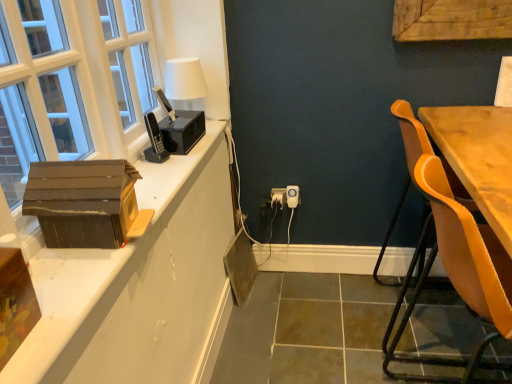
Question: Could you tell me if brown cardboard box at left, which is counted as the first cardboard box, starting from the top, is turned towards white plastic electric outlet at center?

Choices:
 (A) yes
 (B) no

Answer: (B)

Question: From a real-world perspective, is brown cardboard box at left, the second cardboard box in the front-to-back sequence, physically below white plastic electric outlet at center?

Choices:
 (A) no
 (B) yes

Answer: (A)

Question: Does brown cardboard box at left, the second cardboard box when ordered from bottom to top, have a lesser width compared to white plastic electric outlet at center?

Choices:
 (A) yes
 (B) no

Answer: (B)

Question: From the image's perspective, does brown cardboard box at left, the second cardboard box in the front-to-back sequence, appear lower than white plastic electric outlet at center?

Choices:
 (A) yes
 (B) no

Answer: (B)

Question: Can you see brown cardboard box at left, which is counted as the first cardboard box, starting from the top, touching white plastic electric outlet at center?

Choices:
 (A) no
 (B) yes

Answer: (A)

Question: Does brown cardboard box at left, which is counted as the first cardboard box, starting from the top, contain white plastic electric outlet at center?

Choices:
 (A) no
 (B) yes

Answer: (A)

Question: Can you confirm if leatherette chair at right is thinner than white matte table lamp at upper left?

Choices:
 (A) no
 (B) yes

Answer: (A)

Question: Is leatherette chair at right oriented towards white matte table lamp at upper left?

Choices:
 (A) yes
 (B) no

Answer: (B)

Question: Considering the relative sizes of leatherette chair at right and white matte table lamp at upper left in the image provided, is leatherette chair at right bigger than white matte table lamp at upper left?

Choices:
 (A) yes
 (B) no

Answer: (A)

Question: From a real-world perspective, is leatherette chair at right under white matte table lamp at upper left?

Choices:
 (A) yes
 (B) no

Answer: (A)

Question: Can you confirm if leatherette chair at right is positioned to the left of white matte table lamp at upper left?

Choices:
 (A) no
 (B) yes

Answer: (A)

Question: Considering the relative positions of leatherette chair at right and white matte table lamp at upper left in the image provided, is leatherette chair at right to the right of white matte table lamp at upper left from the viewer's perspective?

Choices:
 (A) yes
 (B) no

Answer: (A)

Question: From the image's perspective, is white matte table lamp at upper left over leatherette chair at right?

Choices:
 (A) yes
 (B) no

Answer: (A)